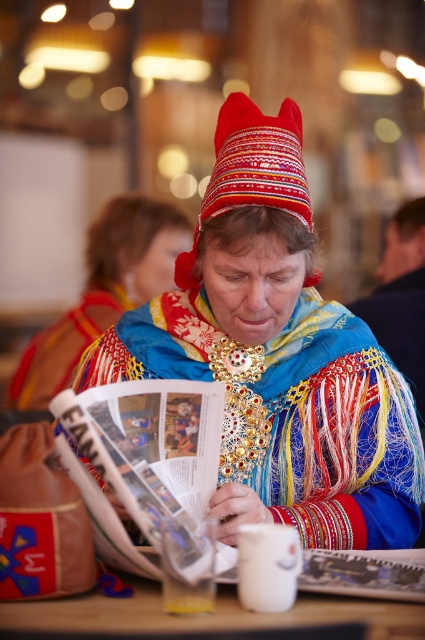
Between multicolored woven scarf at center and printed paper magazine at center, which one is positioned lower?

printed paper magazine at center is below.

Can you confirm if multicolored woven scarf at center is positioned to the right of printed paper magazine at center?

Correct, you'll find multicolored woven scarf at center to the right of printed paper magazine at center.

Where is `multicolored woven scarf at center`? multicolored woven scarf at center is located at coordinates (277, 355).

Find the location of a particular element. The image size is (425, 640). multicolored woven scarf at center is located at coordinates (277, 355).

The height and width of the screenshot is (640, 425). Identify the location of printed paper magazine at center. 150,445.

Between printed paper magazine at center and embroidered felt hat at center, which one appears on the left side from the viewer's perspective?

From the viewer's perspective, printed paper magazine at center appears more on the left side.

Is point (197, 563) in front of point (300, 116)?

Yes, point (197, 563) is closer to viewer.

Locate an element on the screen. printed paper magazine at center is located at coordinates (150, 445).

Consider the image. Can you confirm if multicolored woven scarf at center is shorter than embroidered felt hat at center?

In fact, multicolored woven scarf at center may be taller than embroidered felt hat at center.

Which is behind, point (220, 246) or point (189, 266)?

Positioned behind is point (189, 266).

Between point (334, 404) and point (282, 120), which one is positioned in front?

Point (282, 120) is more forward.

Find the location of `multicolored woven scarf at center`. multicolored woven scarf at center is located at coordinates (277, 355).